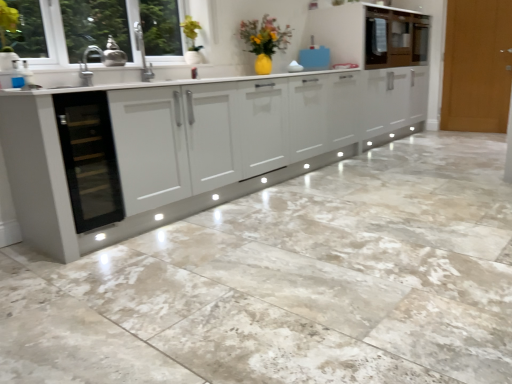
Question: Does metallic brass teapot at upper left, which is the first appliance in front-to-back order, turn towards transparent glass wine cooler at left?

Choices:
 (A) yes
 (B) no

Answer: (B)

Question: Would you say metallic brass teapot at upper left, which is the first appliance in left-to-right order, contains transparent glass wine cooler at left?

Choices:
 (A) yes
 (B) no

Answer: (B)

Question: Is metallic brass teapot at upper left, which is the 1th appliance in bottom-to-top order, closer to the viewer compared to transparent glass wine cooler at left?

Choices:
 (A) no
 (B) yes

Answer: (A)

Question: Can you confirm if metallic brass teapot at upper left, which is the first appliance in front-to-back order, is bigger than transparent glass wine cooler at left?

Choices:
 (A) no
 (B) yes

Answer: (A)

Question: Can we say metallic brass teapot at upper left, which is the first appliance in left-to-right order, lies outside transparent glass wine cooler at left?

Choices:
 (A) yes
 (B) no

Answer: (A)

Question: Is metallic brass teapot at upper left, the 2th appliance viewed from the back, smaller than transparent glass wine cooler at left?

Choices:
 (A) yes
 (B) no

Answer: (A)

Question: Are blue plastic bag at upper center, arranged as the 1th appliance when viewed from the back, and clear glass window at upper left making contact?

Choices:
 (A) yes
 (B) no

Answer: (B)

Question: Does blue plastic bag at upper center, positioned as the first appliance in right-to-left order, have a greater width compared to clear glass window at upper left?

Choices:
 (A) yes
 (B) no

Answer: (B)

Question: Is the depth of blue plastic bag at upper center, which appears as the 1th appliance when viewed from the top, greater than that of clear glass window at upper left?

Choices:
 (A) yes
 (B) no

Answer: (A)

Question: Is blue plastic bag at upper center, acting as the second appliance starting from the front, at the right side of clear glass window at upper left?

Choices:
 (A) yes
 (B) no

Answer: (A)

Question: Does blue plastic bag at upper center, arranged as the 1th appliance when viewed from the back, have a lesser width compared to clear glass window at upper left?

Choices:
 (A) no
 (B) yes

Answer: (B)

Question: Is clear glass window at upper left inside blue plastic bag at upper center, which appears as the 1th appliance when viewed from the top?

Choices:
 (A) no
 (B) yes

Answer: (A)

Question: Can you confirm if transparent glass wine cooler at left is smaller than light brown wooden door at right?

Choices:
 (A) yes
 (B) no

Answer: (A)